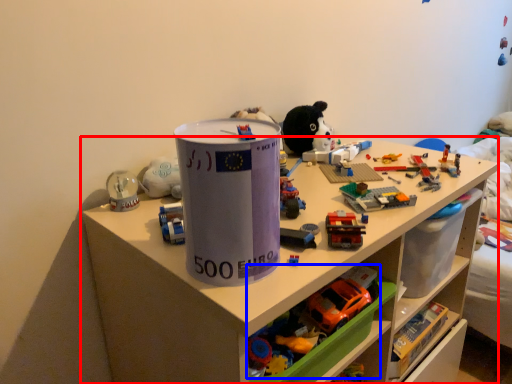
Question: Which object appears farthest to the camera in this image, shelf (highlighted by a red box) or toy (highlighted by a blue box)?

Choices:
 (A) shelf
 (B) toy

Answer: (B)